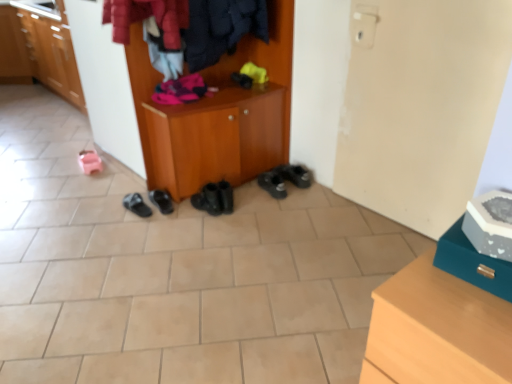
The image size is (512, 384). Identify the location of vacant space situated on the left part of pink rubber sandals at lower left, which is the first footwear in left-to-right order. (64, 163).